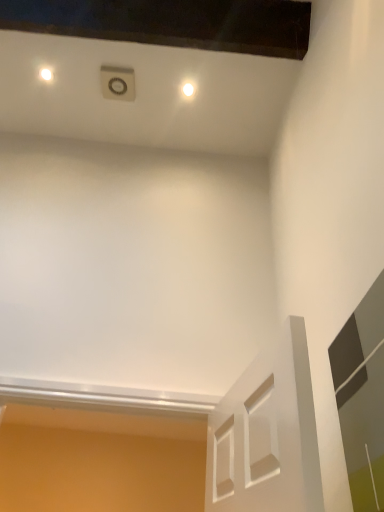
Question: Is transparent glass door at right oriented towards white glossy light at upper center?

Choices:
 (A) yes
 (B) no

Answer: (B)

Question: Does transparent glass door at right have a lesser width compared to white glossy light at upper center?

Choices:
 (A) yes
 (B) no

Answer: (A)

Question: From a real-world perspective, is transparent glass door at right over white glossy light at upper center?

Choices:
 (A) no
 (B) yes

Answer: (A)

Question: Is transparent glass door at right placed right next to white glossy light at upper center?

Choices:
 (A) no
 (B) yes

Answer: (A)

Question: From the image's perspective, would you say transparent glass door at right is positioned over white glossy light at upper center?

Choices:
 (A) yes
 (B) no

Answer: (B)

Question: Would you say white glossy light at upper center is part of transparent glass door at right's contents?

Choices:
 (A) no
 (B) yes

Answer: (A)

Question: Is white glossy light at upper center looking in the opposite direction of transparent glass door at right?

Choices:
 (A) no
 (B) yes

Answer: (A)

Question: Is white glossy light at upper center thinner than transparent glass door at right?

Choices:
 (A) no
 (B) yes

Answer: (A)

Question: From a real-world perspective, does white glossy light at upper center sit lower than transparent glass door at right?

Choices:
 (A) no
 (B) yes

Answer: (A)

Question: Does white glossy light at upper center come behind transparent glass door at right?

Choices:
 (A) no
 (B) yes

Answer: (B)

Question: From the image's perspective, would you say white glossy light at upper center is shown under transparent glass door at right?

Choices:
 (A) yes
 (B) no

Answer: (B)

Question: Can you confirm if white glossy light at upper center is bigger than transparent glass door at right?

Choices:
 (A) no
 (B) yes

Answer: (A)

Question: Is white glossy light at upper center in front of or behind transparent glass door at right in the image?

Choices:
 (A) front
 (B) behind

Answer: (B)